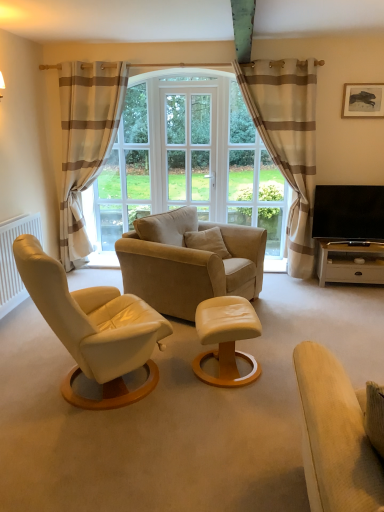
Question: Is clear glass window at center facing away from matte leather ottoman at center, which is the second table from top to bottom?

Choices:
 (A) yes
 (B) no

Answer: (B)

Question: From the image's perspective, would you say clear glass window at center is shown under matte leather ottoman at center, which is the 1th table from bottom to top?

Choices:
 (A) no
 (B) yes

Answer: (A)

Question: Does clear glass window at center come behind matte leather ottoman at center, which is counted as the first table, starting from the front?

Choices:
 (A) yes
 (B) no

Answer: (A)

Question: Are clear glass window at center and matte leather ottoman at center, which is the second table in back-to-front order, far apart?

Choices:
 (A) no
 (B) yes

Answer: (B)

Question: From the image's perspective, is clear glass window at center over matte leather ottoman at center, which is counted as the first table, starting from the front?

Choices:
 (A) no
 (B) yes

Answer: (B)

Question: Visually, is beige striped curtain at right, placed as the second curtain when sorted from left to right, positioned to the left or to the right of white matte radiator at left?

Choices:
 (A) right
 (B) left

Answer: (A)

Question: Looking at their shapes, would you say beige striped curtain at right, which is the first curtain in right-to-left order, is wider or thinner than white matte radiator at left?

Choices:
 (A) wide
 (B) thin

Answer: (A)

Question: Is point (269, 104) closer or farther from the camera than point (28, 224)?

Choices:
 (A) farther
 (B) closer

Answer: (A)

Question: Looking at the image, does beige striped curtain at right, which is the first curtain in right-to-left order, seem bigger or smaller compared to white matte radiator at left?

Choices:
 (A) big
 (B) small

Answer: (A)

Question: In the image, is wooden framed picture at upper right on the left side or the right side of beige striped curtain at right, which is the first curtain in right-to-left order?

Choices:
 (A) left
 (B) right

Answer: (B)

Question: From a real-world perspective, relative to beige striped curtain at right, placed as the second curtain when sorted from left to right, is wooden framed picture at upper right vertically above or below?

Choices:
 (A) below
 (B) above

Answer: (B)

Question: Considering the positions of point (359, 112) and point (296, 269), is point (359, 112) closer or farther from the camera than point (296, 269)?

Choices:
 (A) closer
 (B) farther

Answer: (A)

Question: Considering the positions of wooden framed picture at upper right and beige striped curtain at right, placed as the second curtain when sorted from left to right, in the image, is wooden framed picture at upper right taller or shorter than beige striped curtain at right, placed as the second curtain when sorted from left to right,?

Choices:
 (A) tall
 (B) short

Answer: (B)

Question: From the image's perspective, relative to white glossy table at right, which appears as the second table when viewed from the left, is white glass screen door at center above or below?

Choices:
 (A) below
 (B) above

Answer: (B)

Question: Based on their positions, is white glass screen door at center located to the left or right of white glossy table at right, positioned as the second table in bottom-to-top order?

Choices:
 (A) right
 (B) left

Answer: (B)